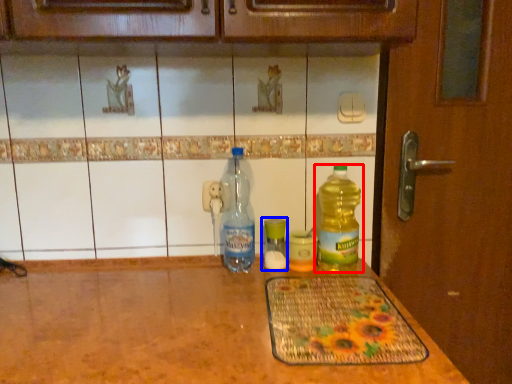
Question: Which object is closer to the camera taking this photo, bottle (highlighted by a red box) or bottle (highlighted by a blue box)?

Choices:
 (A) bottle
 (B) bottle

Answer: (A)